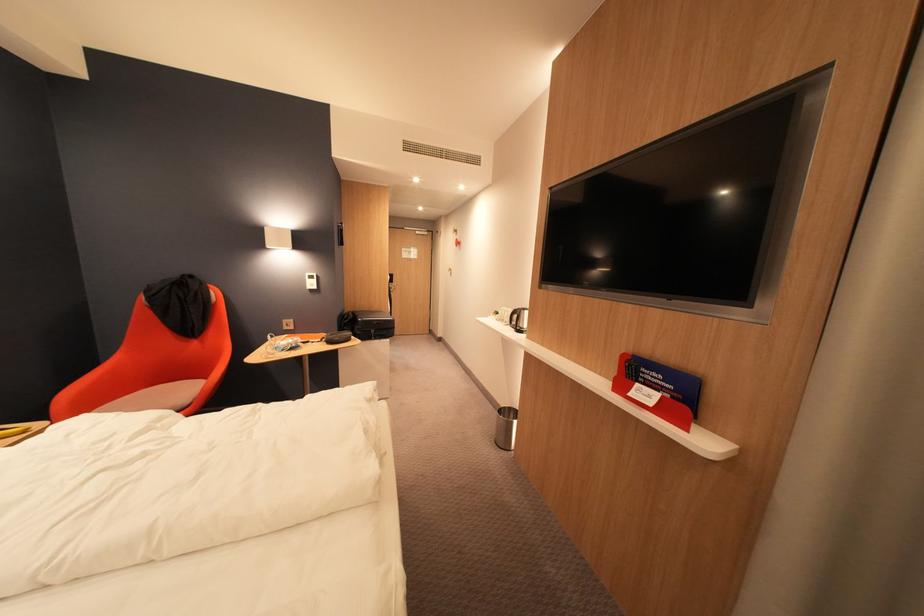
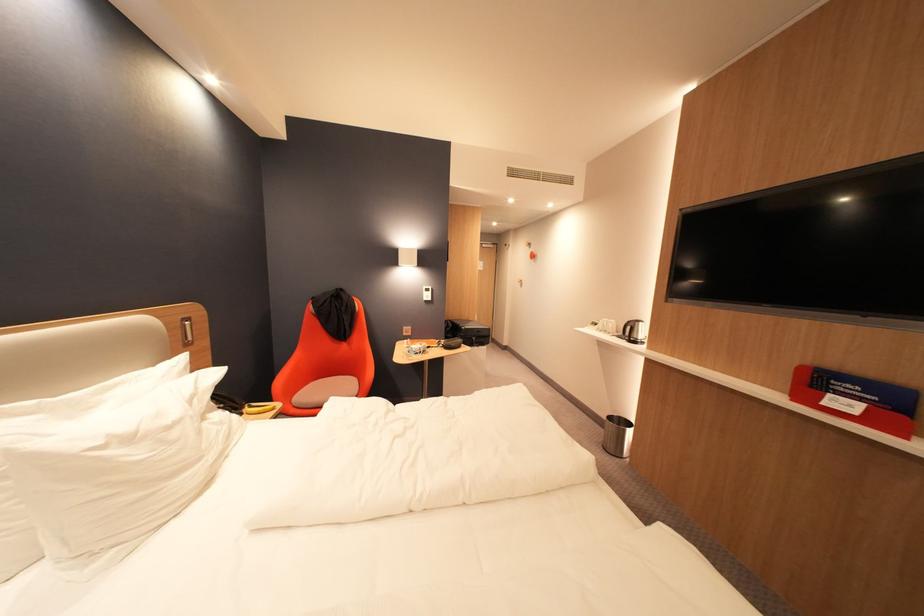
Which direction would the cameraman need to move to produce the second image?

The movement direction of the cameraman is left, backward.